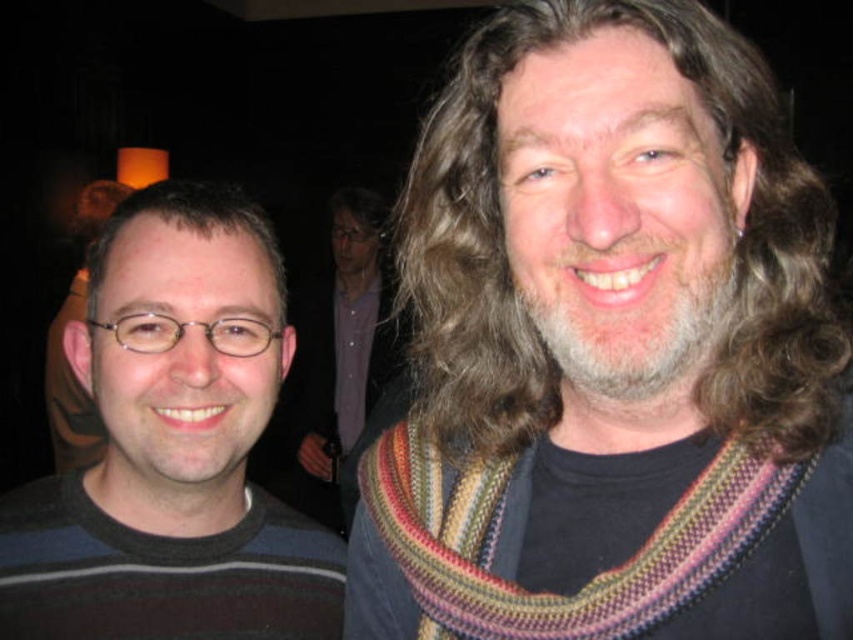
You are at a party and want to take a photo of the two people in the image. You need to focus on the person closer to the camera. Which point should you focus on, point (531, 547) or point (102, 244)?

Point (531, 547) is closer to the viewer than point (102, 244), so you should focus on point (531, 547) to capture the person closer to the camera.

You are a photographer adjusting the lighting for a portrait. You need to ensure that the knitted multicolored scarf at right and the dark brown hair at left are both clearly visible. Based on their positions, which object is closer to the camera?

The knitted multicolored scarf at right is positioned under the dark brown hair at left, meaning the scarf is closer to the camera than the hair.

Looking at this image, you are a photographer at a party trying to capture a closeup shot of the knitted scarf at center and the dark brown hair at left. Your camera can only focus on objects within a 1.5 meter range. Will both subjects be in focus?

The knitted scarf at center is 2.04 meters from dark brown hair at left. Since the camera can only focus within 1.5 meters, the distance between them exceeds the focus range. Therefore, both subjects cannot be in focus simultaneously.